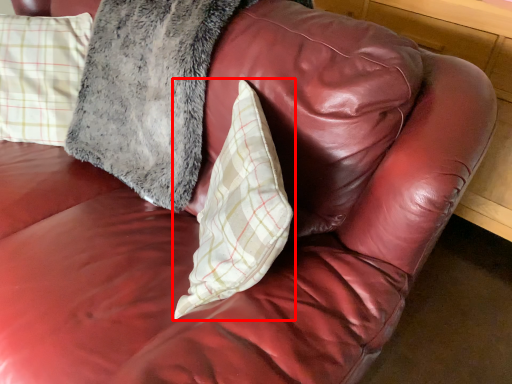
Question: Observing the image, what is the correct spatial positioning of pillow (annotated by the red box) in reference to pillow?

Choices:
 (A) left
 (B) right

Answer: (B)